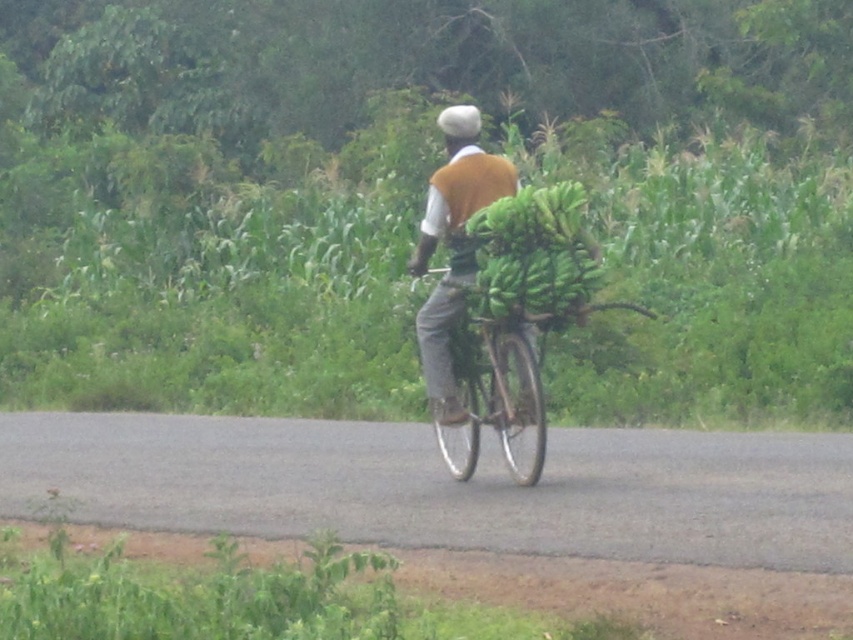
Is point (531, 230) positioned behind point (454, 380)?

No.

Identify the location of green matte bananas at center. (x=534, y=252).

Is green matte bananas at center behind orange fabric at center?

No, it is not.

Which is behind, point (553, 243) or point (419, 272)?

Point (419, 272)

The width and height of the screenshot is (853, 640). I want to click on green matte bananas at center, so click(534, 252).

Can you confirm if orange fabric at center is positioned above metallic silver bicycle at center?

Indeed, orange fabric at center is positioned over metallic silver bicycle at center.

Which is behind, point (450, 275) or point (465, 378)?

The point (465, 378) is behind.

Image resolution: width=853 pixels, height=640 pixels. Identify the location of orange fabric at center. (460, 193).